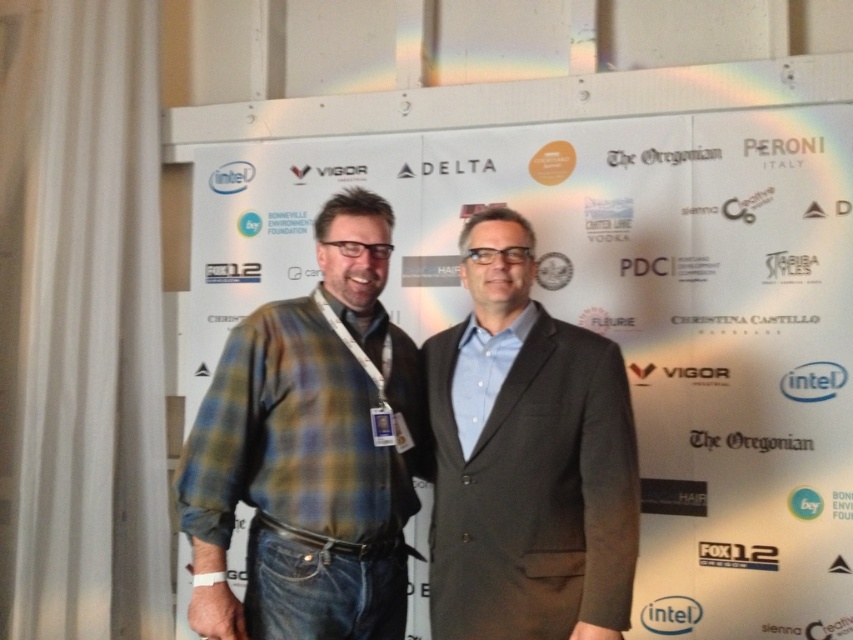
You are a photographer setting up for a group photo. You need to ensure that both the plaid flannel shirt at center and the dark gray suit at center are fully visible in the frame. Given their sizes, which clothing item requires more space to accommodate its width?

The plaid flannel shirt at center requires more space because its width is larger than the dark gray suit at center.

You are attending a professional networking event and see two individuals at the center of the scene. One is wearing a plaid flannel shirt at center and the other a dark gray suit at center. Based on their attire, which individual is positioned closer to you?

The plaid flannel shirt at center is closer to you because the dark gray suit at center is positioned behind it.